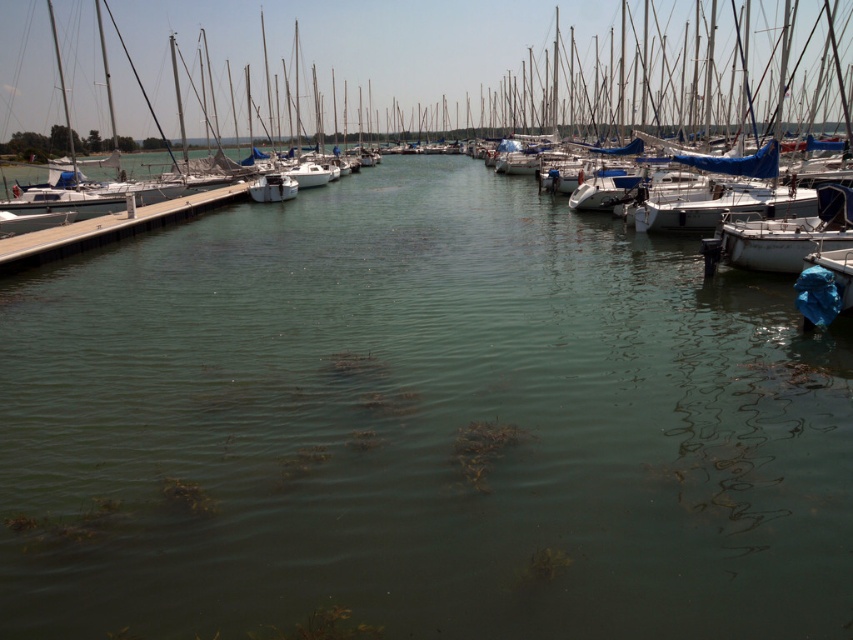
Question: Among these objects, which one is farthest from the camera?

Choices:
 (A) white matte boat at center
 (B) smooth wooden dock at left

Answer: (A)

Question: Does smooth wooden dock at left appear under white matte boat at center?

Choices:
 (A) no
 (B) yes

Answer: (B)

Question: Which of the following is the closest to the observer?

Choices:
 (A) smooth wooden dock at left
 (B) white matte boat at center

Answer: (A)

Question: Observing the image, what is the correct spatial positioning of smooth wooden dock at left in reference to white matte boat at center?

Choices:
 (A) right
 (B) left

Answer: (B)

Question: Does smooth wooden dock at left appear over white matte boat at center?

Choices:
 (A) yes
 (B) no

Answer: (B)

Question: Which point is farther from the camera taking this photo?

Choices:
 (A) pyautogui.click(x=119, y=211)
 (B) pyautogui.click(x=286, y=182)

Answer: (B)